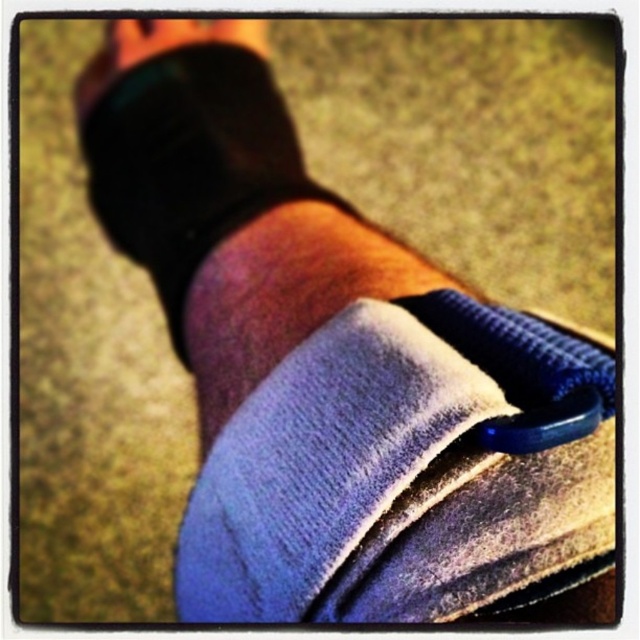
Question: Can you confirm if blue velvety sock at center is smaller than velvet blue strap at center?

Choices:
 (A) no
 (B) yes

Answer: (A)

Question: Which object is closer to the camera taking this photo?

Choices:
 (A) blue velvety sock at center
 (B) velvet blue strap at center
 (C) matte black toe at upper center
 (D) black matte sock at center

Answer: (A)

Question: Can you confirm if black matte sock at center is smaller than velvet blue strap at center?

Choices:
 (A) yes
 (B) no

Answer: (B)

Question: Estimate the real-world distances between objects in this image. Which object is farther from the black matte sock at center?

Choices:
 (A) blue velvety sock at center
 (B) matte black toe at upper center

Answer: (A)

Question: Is black matte sock at center closer to camera compared to velvet blue strap at center?

Choices:
 (A) no
 (B) yes

Answer: (A)

Question: Which of these objects is positioned closest to the black matte sock at center?

Choices:
 (A) blue velvety sock at center
 (B) velvet blue strap at center
 (C) matte black toe at upper center

Answer: (C)